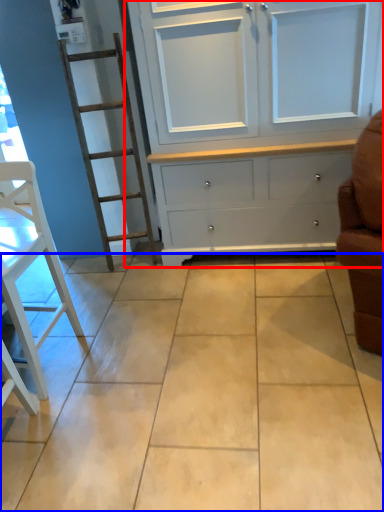
Question: Which object appears farthest to the camera in this image, cupboard (highlighted by a red box) or ceramic tile (highlighted by a blue box)?

Choices:
 (A) cupboard
 (B) ceramic tile

Answer: (A)